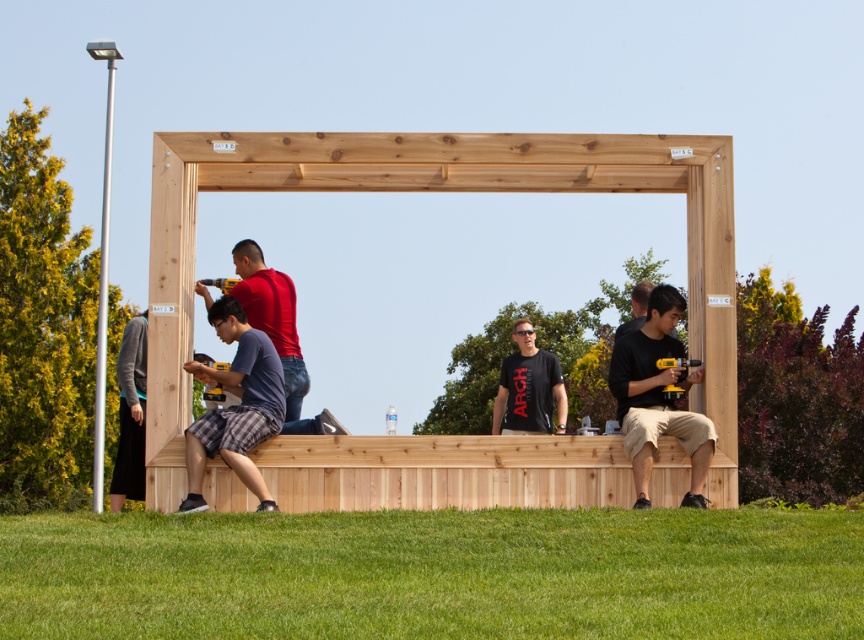
Question: Does natural wood frame at center have a larger size compared to black matte t-shirt at center?

Choices:
 (A) yes
 (B) no

Answer: (A)

Question: Is natural wood frame at center to the left of matte black shirt at center from the viewer's perspective?

Choices:
 (A) no
 (B) yes

Answer: (B)

Question: Which point appears closest to the camera in this image?

Choices:
 (A) (232, 304)
 (B) (666, 332)
 (C) (278, 282)
 (D) (293, 157)

Answer: (D)

Question: Which point is farther to the camera?

Choices:
 (A) (143, 493)
 (B) (200, 500)
 (C) (634, 445)

Answer: (A)

Question: Which of the following is the farthest from the observer?

Choices:
 (A) (124, 461)
 (B) (690, 436)
 (C) (283, 483)

Answer: (A)

Question: From the image, what is the correct spatial relationship of matte red shirt at center in relation to black matte t-shirt at center?

Choices:
 (A) right
 (B) left

Answer: (B)